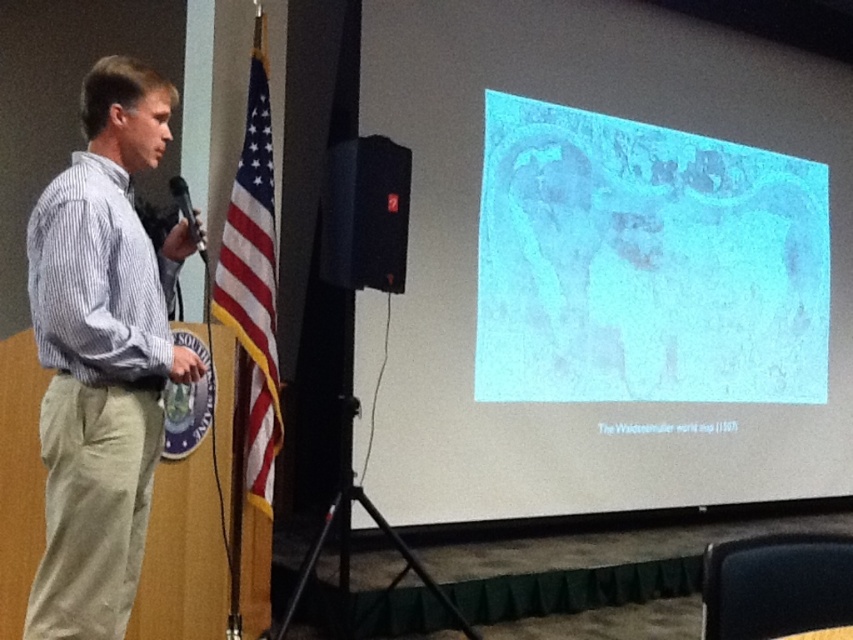
Is point (556, 369) behind point (141, 234)?

That is True.

You are a GUI agent. You are given a task and a screenshot of the screen. Output one action in this format:
    pyautogui.click(x=<x>, y=<y>)
    Task: Click on the blue translucent map at upper right
    This screenshot has width=853, height=640.
    Given the screenshot: What is the action you would take?
    pyautogui.click(x=645, y=262)

Does american flag at left have a greater height compared to black matte speaker at center?

Indeed, american flag at left has a greater height compared to black matte speaker at center.

Is american flag at left thinner than black matte speaker at center?

Correct, american flag at left's width is less than black matte speaker at center's.

Is point (268, 483) in front of point (401, 253)?

No.

Where is `american flag at left`? The width and height of the screenshot is (853, 640). american flag at left is located at coordinates coord(253,282).

Does striped cotton shirt at left appear on the left side of american flag at left?

Correct, you'll find striped cotton shirt at left to the left of american flag at left.

Is striped cotton shirt at left smaller than american flag at left?

Actually, striped cotton shirt at left might be larger than american flag at left.

This screenshot has height=640, width=853. I want to click on striped cotton shirt at left, so click(102, 355).

Where is `striped cotton shirt at left`? striped cotton shirt at left is located at coordinates (102, 355).